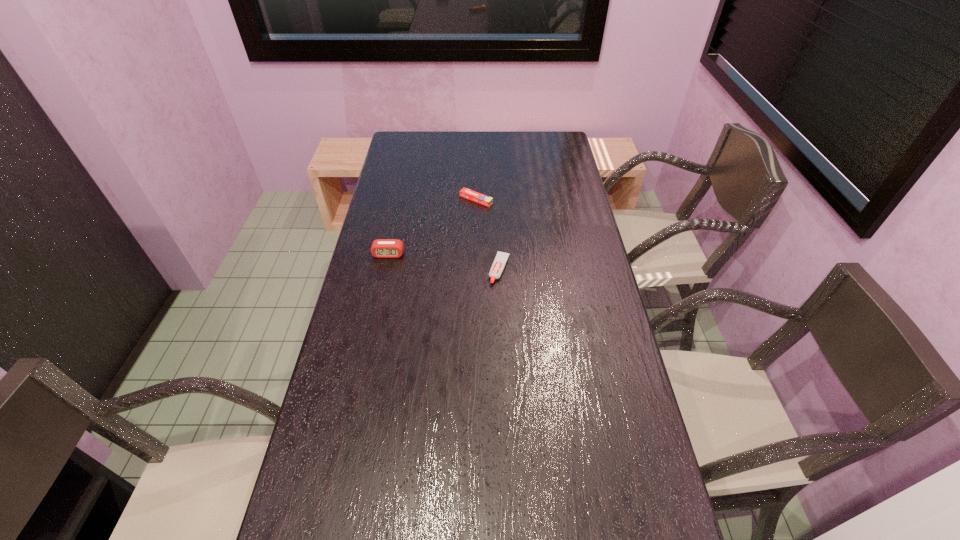
Find the location of a particular element. free space that is in between the tallest object and the nearer toothpaste is located at coordinates (444, 262).

The height and width of the screenshot is (540, 960). What are the coordinates of `blank region between the tallest object and the second tallest object` in the screenshot? It's located at (444, 262).

Locate an element on the screen. This screenshot has height=540, width=960. free space that is in between the taller toothpaste and the leftmost object is located at coordinates (444, 262).

You are a GUI agent. You are given a task and a screenshot of the screen. Output one action in this format:
    pyautogui.click(x=<x>, y=<y>)
    Task: Click on the vacant point located between the alarm clock and the taller toothpaste
    
    Given the screenshot: What is the action you would take?
    pyautogui.click(x=444, y=262)

This screenshot has height=540, width=960. I want to click on the second closest object to the nearer toothpaste, so click(381, 248).

Identify which object is the second closest to the shortest object. Please provide its 2D coordinates. Your answer should be formatted as a tuple, i.e. [(x, y)], where the tuple contains the x and y coordinates of a point satisfying the conditions above.

[(381, 248)]

Image resolution: width=960 pixels, height=540 pixels. I want to click on vacant area in the image that satisfies the following two spatial constraints: 1. on the front side of the shortest object; 2. on the left side of the taller toothpaste, so click(475, 269).